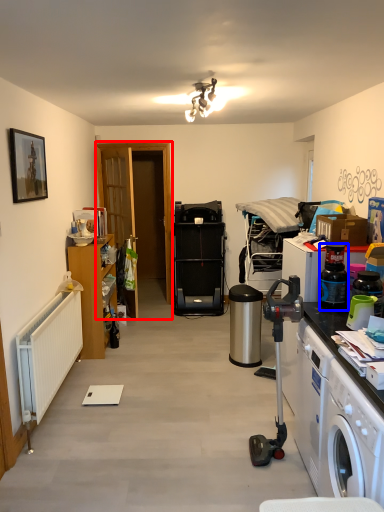
Question: Which point is further to the camera, door (highlighted by a red box) or bottle (highlighted by a blue box)?

Choices:
 (A) door
 (B) bottle

Answer: (A)